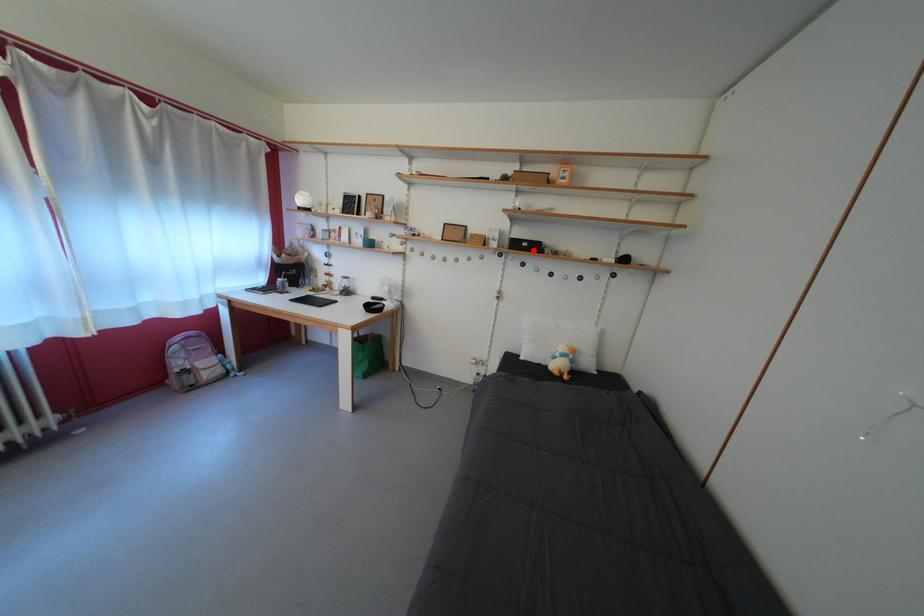
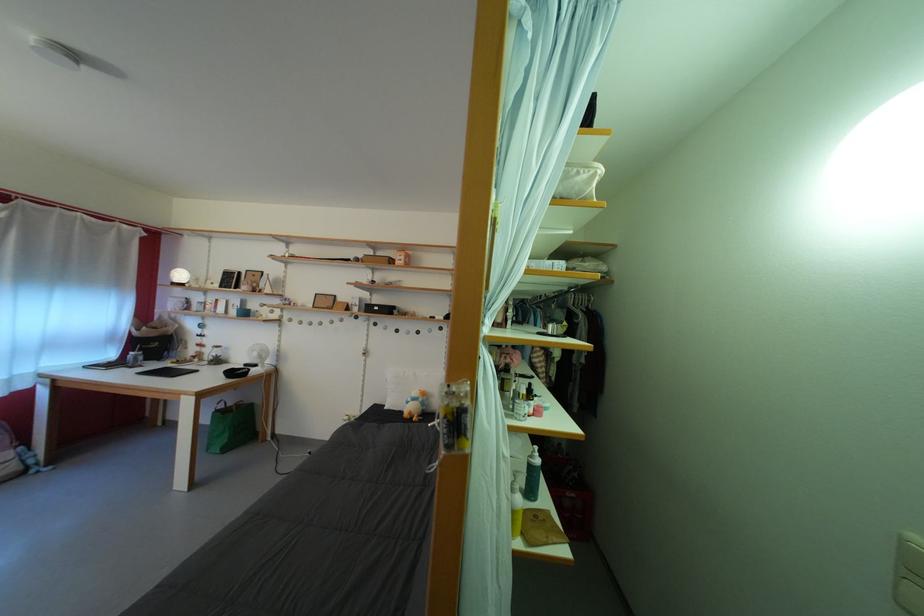
Where in the second image is the point corresponding to the highlighted location from the first image?

(384, 314)